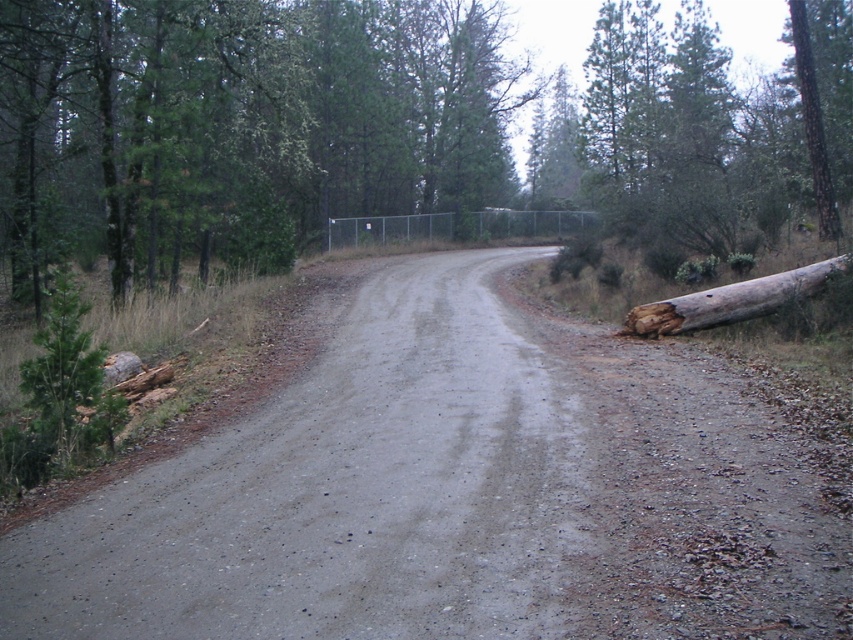
Which of these two, gray gravel road at center or brown rough log at right, stands shorter?

Standing shorter between the two is gray gravel road at center.

Does point (755, 563) lie in front of point (657, 336)?

Yes, it is.

You are a GUI agent. You are given a task and a screenshot of the screen. Output one action in this format:
    pyautogui.click(x=<x>, y=<y>)
    Task: Click on the gray gravel road at center
    
    Given the screenshot: What is the action you would take?
    pyautogui.click(x=454, y=493)

Consider the image. Can you confirm if brown rough log at right is bigger than brown rough tree trunk at upper right?

Incorrect, brown rough log at right is not larger than brown rough tree trunk at upper right.

Between brown rough log at right and brown rough tree trunk at upper right, which one has less height?

brown rough log at right

Find the location of `brown rough log at right`. brown rough log at right is located at coordinates (730, 300).

Who is shorter, brown wood log at right or brown rough tree trunk at upper right?

With less height is brown rough tree trunk at upper right.

Who is positioned more to the right, brown wood log at right or brown rough tree trunk at upper right?

Positioned to the right is brown rough tree trunk at upper right.

Between point (148, 188) and point (824, 228), which one is positioned in front?

Point (148, 188) is more forward.

The image size is (853, 640). What are the coordinates of `brown wood log at right` in the screenshot? It's located at (241, 125).